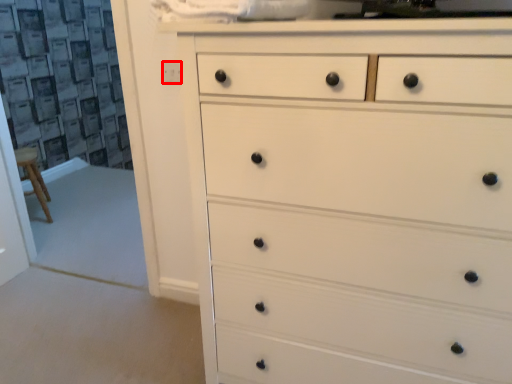
Question: From the image's perspective, what is the correct spatial positioning of knob (annotated by the red box) in reference to chest of drawers?

Choices:
 (A) below
 (B) above

Answer: (B)